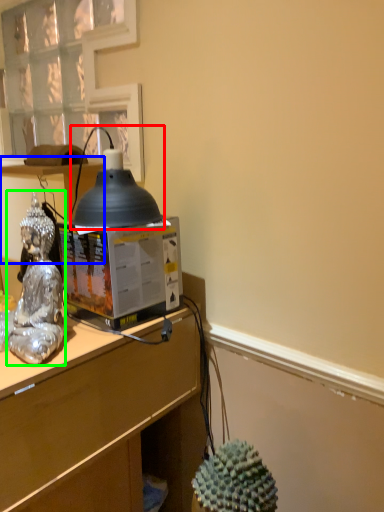
Question: Which is farther away from lamp (highlighted by a red box)? vanity (highlighted by a blue box) or person (highlighted by a green box)?

Choices:
 (A) vanity
 (B) person

Answer: (A)